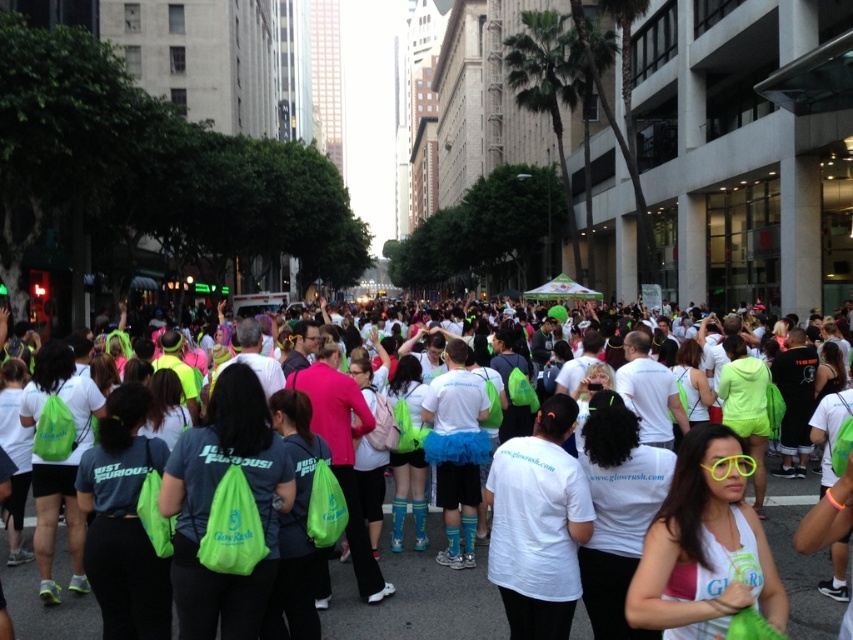
Does green fabric bag at center have a greater height compared to neon yellow plastic sunglasses at center?

No.

Is point (33, 512) more distant than point (672, 477)?

Yes, it is.

Between point (431, 556) and point (717, 490), which one is positioned in front?

Positioned in front is point (717, 490).

The image size is (853, 640). In order to click on green fabric bag at center in this screenshot , I will do `click(416, 595)`.